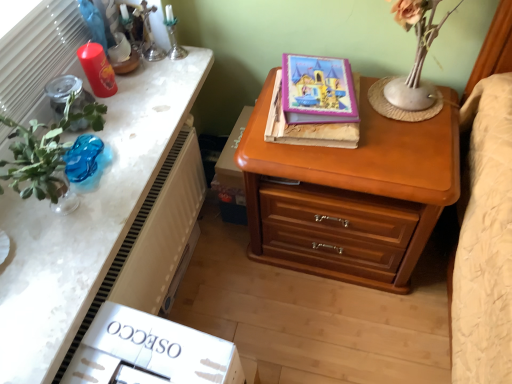
You are a GUI agent. You are given a task and a screenshot of the screen. Output one action in this format:
    pyautogui.click(x=<x>, y=<y>)
    Task: Click on the purple glossy book at upper center, which ranks as the second book in bottom-to-top order
    
    Given the screenshot: What is the action you would take?
    pyautogui.click(x=317, y=90)

Measure the distance between purple glossy book at upper center, placed as the first book when sorted from top to bottom, and camera.

purple glossy book at upper center, placed as the first book when sorted from top to bottom, and camera are 3.52 feet apart.

This screenshot has height=384, width=512. Describe the element at coordinates (160, 232) in the screenshot. I see `white textured radiator at left` at that location.

Describe the element at coordinates (306, 128) in the screenshot. The width and height of the screenshot is (512, 384). I see `hardcover book at center, positioned as the 2th book in top-to-bottom order` at that location.

The image size is (512, 384). I want to click on wooden nightstand at upper center, so click(x=87, y=221).

The width and height of the screenshot is (512, 384). I want to click on purple glossy book at upper center, which ranks as the second book in bottom-to-top order, so click(317, 90).

This screenshot has height=384, width=512. What are the coordinates of `the 1st book behind the white textured radiator at left, starting your count from the anchor` in the screenshot? It's located at (317, 90).

Is purple glossy book at upper center, placed as the first book when sorted from top to bottom, to the left or to the right of white textured radiator at left in the image?

In the image, purple glossy book at upper center, placed as the first book when sorted from top to bottom, appears on the right side of white textured radiator at left.

Is purple glossy book at upper center, which ranks as the second book in bottom-to-top order, looking in the opposite direction of white textured radiator at left?

No, purple glossy book at upper center, which ranks as the second book in bottom-to-top order,'s orientation is not away from white textured radiator at left.

Is point (307, 74) behind point (152, 250)?

That is True.

Considering the positions of point (122, 275) and point (358, 103), is point (122, 275) closer or farther from the camera than point (358, 103)?

Point (122, 275) is positioned closer to the camera compared to point (358, 103).

Considering the sizes of objects white textured radiator at left and hardcover book at center, which is the 1th book from bottom to top, in the image provided, who is smaller, white textured radiator at left or hardcover book at center, which is the 1th book from bottom to top,?

hardcover book at center, which is the 1th book from bottom to top, is smaller.

From the image's perspective, relative to hardcover book at center, which is the 1th book from bottom to top, is white textured radiator at left above or below?

From the image's perspective, white textured radiator at left appears below hardcover book at center, which is the 1th book from bottom to top.

In the image, is wooden chest of drawers at right on the left side or the right side of white textured radiator at left?

wooden chest of drawers at right is to the right of white textured radiator at left.

Based on their sizes in the image, would you say wooden chest of drawers at right is bigger or smaller than white textured radiator at left?

In the image, wooden chest of drawers at right appears to be larger than white textured radiator at left.

Is point (246, 140) positioned before point (200, 156)?

That is True.

Based on the photo, which object is wider, translucent blue glass vase at left or hardcover book at center, positioned as the 2th book in top-to-bottom order?

hardcover book at center, positioned as the 2th book in top-to-bottom order, is wider.

Is translucent blue glass vase at left oriented towards hardcover book at center, which is the 1th book from bottom to top?

No, translucent blue glass vase at left is not turned towards hardcover book at center, which is the 1th book from bottom to top.

Considering the relative positions of translucent blue glass vase at left and hardcover book at center, positioned as the 2th book in top-to-bottom order, in the image provided, is translucent blue glass vase at left in front of hardcover book at center, positioned as the 2th book in top-to-bottom order,?

Yes, it is.

Considering the sizes of objects translucent blue glass vase at left and hardcover book at center, positioned as the 2th book in top-to-bottom order, in the image provided, who is shorter, translucent blue glass vase at left or hardcover book at center, positioned as the 2th book in top-to-bottom order,?

hardcover book at center, positioned as the 2th book in top-to-bottom order, is shorter.

Measure the distance between wooden chest of drawers at right and hardcover book at center, positioned as the 2th book in top-to-bottom order.

19.17 centimeters.

Is wooden chest of drawers at right not close to hardcover book at center, positioned as the 2th book in top-to-bottom order?

Actually, wooden chest of drawers at right and hardcover book at center, positioned as the 2th book in top-to-bottom order, are a little close together.

From a real-world perspective, who is located higher, wooden chest of drawers at right or hardcover book at center, which is the 1th book from bottom to top?

From a 3D spatial view, hardcover book at center, which is the 1th book from bottom to top, is above.

Based on the photo, is purple glossy book at upper center, placed as the first book when sorted from top to bottom, bigger or smaller than wooden nightstand at upper center?

Clearly, purple glossy book at upper center, placed as the first book when sorted from top to bottom, is smaller in size than wooden nightstand at upper center.

Is purple glossy book at upper center, which ranks as the second book in bottom-to-top order, looking in the opposite direction of wooden nightstand at upper center?

No, purple glossy book at upper center, which ranks as the second book in bottom-to-top order,'s orientation is not away from wooden nightstand at upper center.

Where is `nightstand that appears in front of the purple glossy book at upper center, placed as the first book when sorted from top to bottom`? This screenshot has width=512, height=384. nightstand that appears in front of the purple glossy book at upper center, placed as the first book when sorted from top to bottom is located at coordinates (87, 221).

Is purple glossy book at upper center, which ranks as the second book in bottom-to-top order, at the right side of wooden nightstand at upper center?

Yes, purple glossy book at upper center, which ranks as the second book in bottom-to-top order, is to the right of wooden nightstand at upper center.

Is wooden nightstand at upper center surrounded by wooden chest of drawers at right?

No.

Is the surface of wooden chest of drawers at right in direct contact with wooden nightstand at upper center?

They are not placed beside each other.

From the image's perspective, which one is positioned higher, wooden chest of drawers at right or wooden nightstand at upper center?

From the image's view, wooden nightstand at upper center is above.

The width and height of the screenshot is (512, 384). There is a white textured radiator at left. Find the location of `the 2nd book above it (from a real-world perspective)`. the 2nd book above it (from a real-world perspective) is located at coordinates click(x=317, y=90).

Which book is the 1st one when counting from the right side of the white textured radiator at left? Please provide its 2D coordinates.

[(306, 128)]

Estimate the real-world distances between objects in this image. Which object is closer to wooden chest of drawers at right, hardcover book at center, positioned as the 2th book in top-to-bottom order, or wooden nightstand at upper center?

hardcover book at center, positioned as the 2th book in top-to-bottom order, is positioned closer to the anchor wooden chest of drawers at right.

From the image, which object appears to be farther from translucent blue glass vase at left, wooden nightstand at upper center or purple glossy book at upper center, which ranks as the second book in bottom-to-top order?

purple glossy book at upper center, which ranks as the second book in bottom-to-top order, is positioned further to the anchor translucent blue glass vase at left.

From the picture: Considering their positions, is hardcover book at center, positioned as the 2th book in top-to-bottom order, positioned further to wooden chest of drawers at right than white textured radiator at left?

white textured radiator at left.

When comparing their distances from wooden chest of drawers at right, does wooden nightstand at upper center or hardcover book at center, which is the 1th book from bottom to top, seem closer?

Among the two, hardcover book at center, which is the 1th book from bottom to top, is located nearer to wooden chest of drawers at right.

Looking at the image, which one is located further to wooden chest of drawers at right, wooden nightstand at upper center or translucent blue glass vase at left?

translucent blue glass vase at left lies further to wooden chest of drawers at right than the other object.

Estimate the real-world distances between objects in this image. Which object is closer to translucent blue glass vase at left, white textured radiator at left or hardcover book at center, which is the 1th book from bottom to top?

Among the two, white textured radiator at left is located nearer to translucent blue glass vase at left.

When comparing their distances from translucent blue glass vase at left, does hardcover book at center, positioned as the 2th book in top-to-bottom order, or purple glossy book at upper center, which ranks as the second book in bottom-to-top order, seem closer?

hardcover book at center, positioned as the 2th book in top-to-bottom order, is positioned closer to the anchor translucent blue glass vase at left.

From the image, which object appears to be nearer to purple glossy book at upper center, placed as the first book when sorted from top to bottom, white textured radiator at left or wooden chest of drawers at right?

wooden chest of drawers at right.

The height and width of the screenshot is (384, 512). Identify the location of book between purple glossy book at upper center, which ranks as the second book in bottom-to-top order, and wooden chest of drawers at right in the up-down direction. (306, 128).

Identify the location of radiator between wooden nightstand at upper center and hardcover book at center, which is the 1th book from bottom to top, in the horizontal direction. The height and width of the screenshot is (384, 512). (160, 232).

Identify the location of nightstand located between translucent blue glass vase at left and purple glossy book at upper center, which ranks as the second book in bottom-to-top order, in the left-right direction. The width and height of the screenshot is (512, 384). (87, 221).

Where is `nightstand between translucent blue glass vase at left and hardcover book at center, positioned as the 2th book in top-to-bottom order, from left to right`? Image resolution: width=512 pixels, height=384 pixels. nightstand between translucent blue glass vase at left and hardcover book at center, positioned as the 2th book in top-to-bottom order, from left to right is located at coordinates (87, 221).